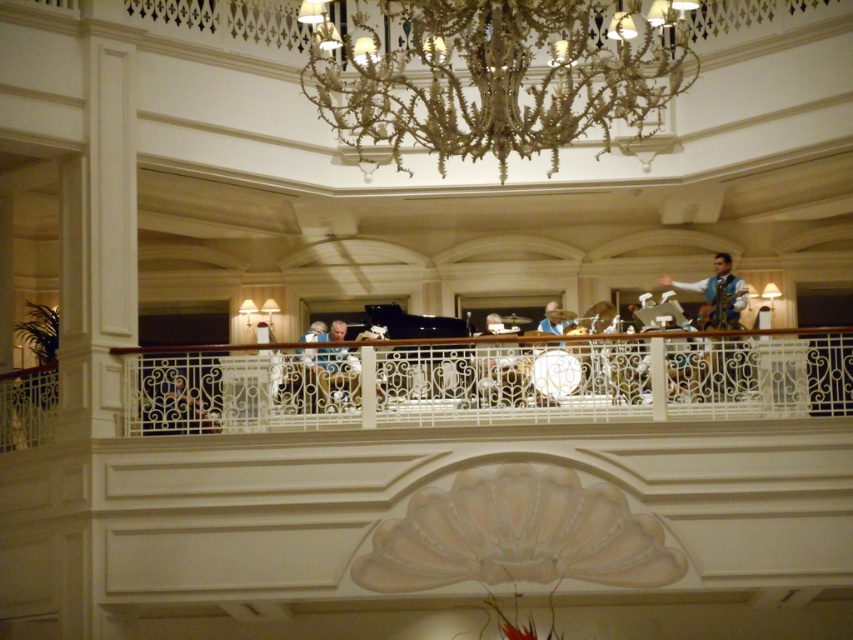
Between gold metallic chandelier at upper center and light blue fabric at upper right, which one appears on the left side from the viewer's perspective?

gold metallic chandelier at upper center is more to the left.

Is point (566, 138) positioned before point (691, 289)?

Yes, it is in front of point (691, 289).

Image resolution: width=853 pixels, height=640 pixels. What do you see at coordinates (496, 74) in the screenshot? I see `gold metallic chandelier at upper center` at bounding box center [496, 74].

This screenshot has width=853, height=640. I want to click on gold metallic chandelier at upper center, so click(x=496, y=74).

Who is lower down, light brown wooden chair at center or light blue fabric at center?

light brown wooden chair at center

How distant is light brown wooden chair at center from light blue fabric at center?

light brown wooden chair at center is 48.56 feet away from light blue fabric at center.

Which is in front, point (173, 378) or point (328, 365)?

Point (173, 378) is more forward.

Where is `light brown wooden chair at center`? This screenshot has width=853, height=640. light brown wooden chair at center is located at coordinates (178, 408).

Can you confirm if gold metallic chandelier at upper center is taller than smooth silver drum at center?

Indeed, gold metallic chandelier at upper center has a greater height compared to smooth silver drum at center.

Is gold metallic chandelier at upper center in front of smooth silver drum at center?

Yes, it is.

Is point (366, 29) behind point (500, 317)?

No, (366, 29) is in front of (500, 317).

Identify the location of gold metallic chandelier at upper center. The width and height of the screenshot is (853, 640). (496, 74).